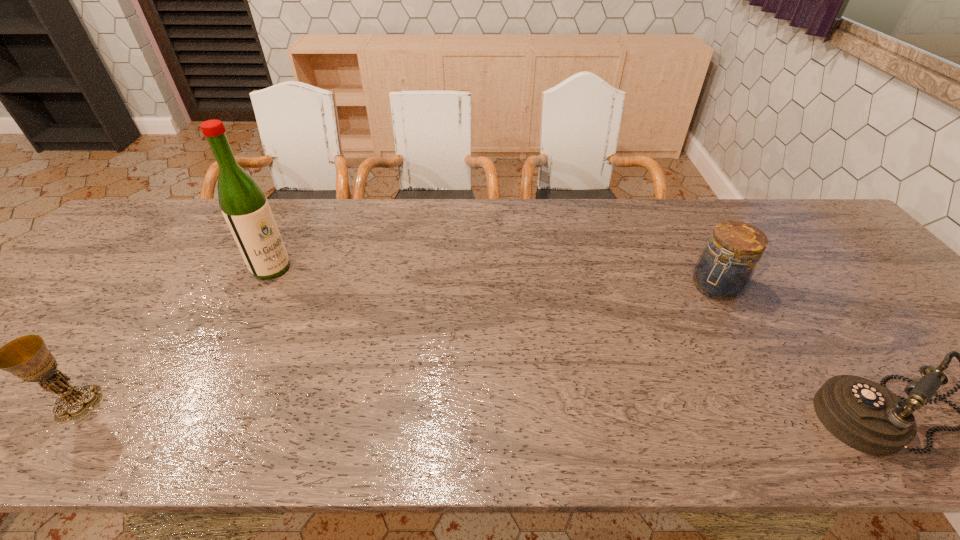
Identify the location of free location located 0.360m on the label of the third object from right to left. (381, 332).

At what (x,y) coordinates should I click in order to perform the action: click on object situated at the near edge. Please return your answer as a coordinate pair (x, y). The image size is (960, 540). Looking at the image, I should click on (27, 357).

Locate an element on the screen. The width and height of the screenshot is (960, 540). vacant space at the far edge is located at coordinates (676, 209).

In order to click on free space at the near edge in this screenshot , I will do `click(691, 381)`.

Where is `vacant space at the right edge`? The image size is (960, 540). vacant space at the right edge is located at coordinates (894, 320).

Where is `vacant area at the far left corner of the desktop`? Image resolution: width=960 pixels, height=540 pixels. vacant area at the far left corner of the desktop is located at coordinates (153, 238).

Where is `free space between the leftmost object and the tallest object`? This screenshot has height=540, width=960. free space between the leftmost object and the tallest object is located at coordinates (175, 336).

The width and height of the screenshot is (960, 540). I want to click on free spot between the chalice and the third object from right to left, so click(175, 336).

Identify the location of unoccupied area between the jar and the liquor. (493, 277).

The height and width of the screenshot is (540, 960). In order to click on object identified as the third closest to the leftmost object in this screenshot , I will do `click(865, 415)`.